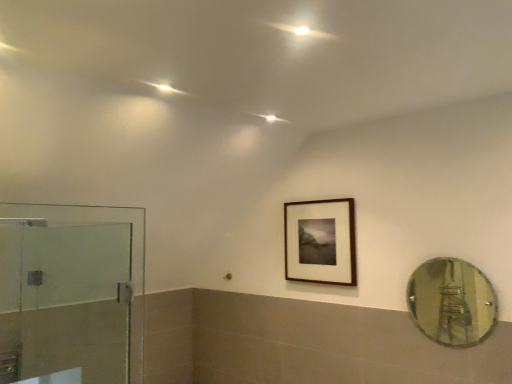
Question: Considering the relative sizes of transparent glass shower door at left and wooden frame at upper center in the image provided, is transparent glass shower door at left shorter than wooden frame at upper center?

Choices:
 (A) yes
 (B) no

Answer: (B)

Question: Could wooden frame at upper center be considered to be inside transparent glass shower door at left?

Choices:
 (A) no
 (B) yes

Answer: (A)

Question: Is transparent glass shower door at left taller than wooden frame at upper center?

Choices:
 (A) yes
 (B) no

Answer: (A)

Question: Is transparent glass shower door at left outside wooden frame at upper center?

Choices:
 (A) yes
 (B) no

Answer: (A)

Question: Is transparent glass shower door at left to the right of wooden frame at upper center from the viewer's perspective?

Choices:
 (A) yes
 (B) no

Answer: (B)

Question: Is transparent glass shower door at left far away from wooden frame at upper center?

Choices:
 (A) no
 (B) yes

Answer: (B)

Question: Would you say clear glass mirror at right is outside wooden frame at upper center?

Choices:
 (A) yes
 (B) no

Answer: (A)

Question: Does clear glass mirror at right lie behind wooden frame at upper center?

Choices:
 (A) yes
 (B) no

Answer: (B)

Question: From a real-world perspective, is clear glass mirror at right over wooden frame at upper center?

Choices:
 (A) yes
 (B) no

Answer: (B)

Question: Is clear glass mirror at right wider than wooden frame at upper center?

Choices:
 (A) yes
 (B) no

Answer: (B)

Question: Is wooden frame at upper center a part of clear glass mirror at right?

Choices:
 (A) yes
 (B) no

Answer: (B)

Question: Can you confirm if clear glass mirror at right is thinner than wooden frame at upper center?

Choices:
 (A) no
 (B) yes

Answer: (B)

Question: From the image's perspective, does wooden frame at upper center appear lower than clear glass mirror at right?

Choices:
 (A) yes
 (B) no

Answer: (B)